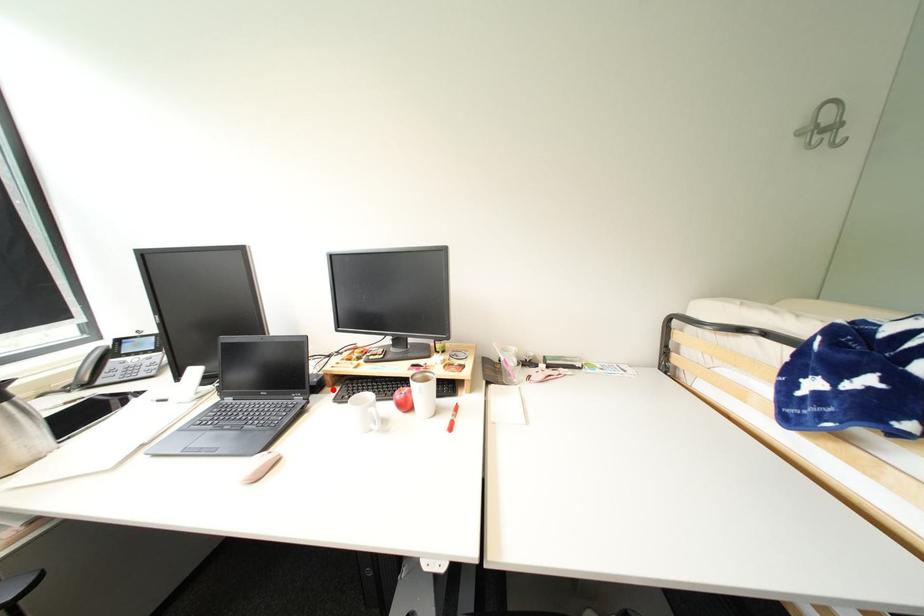
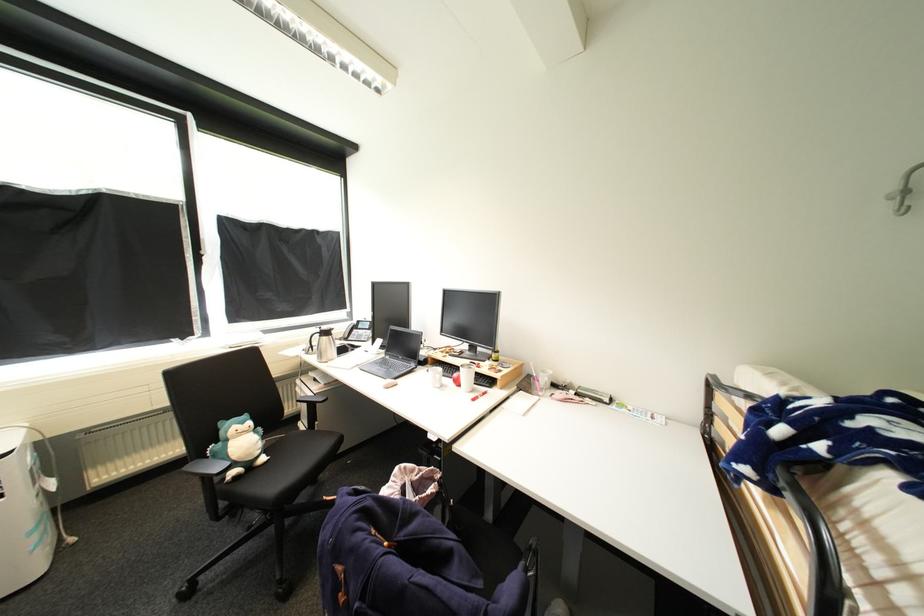
The point at the highlighted location is marked in the first image. Where is the corresponding point in the second image?

(434, 366)